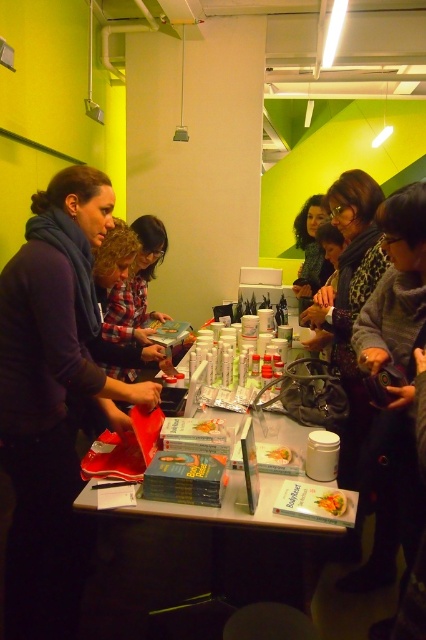
Question: Estimate the real-world distances between objects in this image. Which object is farther from the matte black scarf at left?

Choices:
 (A) matte yellow book at center
 (B) green leafy vegetable at center

Answer: (B)

Question: Based on their relative distances, which object is farther from the matte black scarf at left?

Choices:
 (A) white glossy table at center
 (B) green leafy vegetable at center
 (C) smooth plastic container at center

Answer: (B)

Question: Can you confirm if white glossy table at center is positioned to the left of matte yellow book at center?

Choices:
 (A) yes
 (B) no

Answer: (B)

Question: Is matte black scarf at left bigger than smooth plastic container at center?

Choices:
 (A) no
 (B) yes

Answer: (B)

Question: Which object is closer to the camera taking this photo?

Choices:
 (A) white glossy table at center
 (B) matte yellow book at center

Answer: (B)

Question: Is the position of green leafy vegetable at center less distant than that of matte yellow book at center?

Choices:
 (A) yes
 (B) no

Answer: (A)